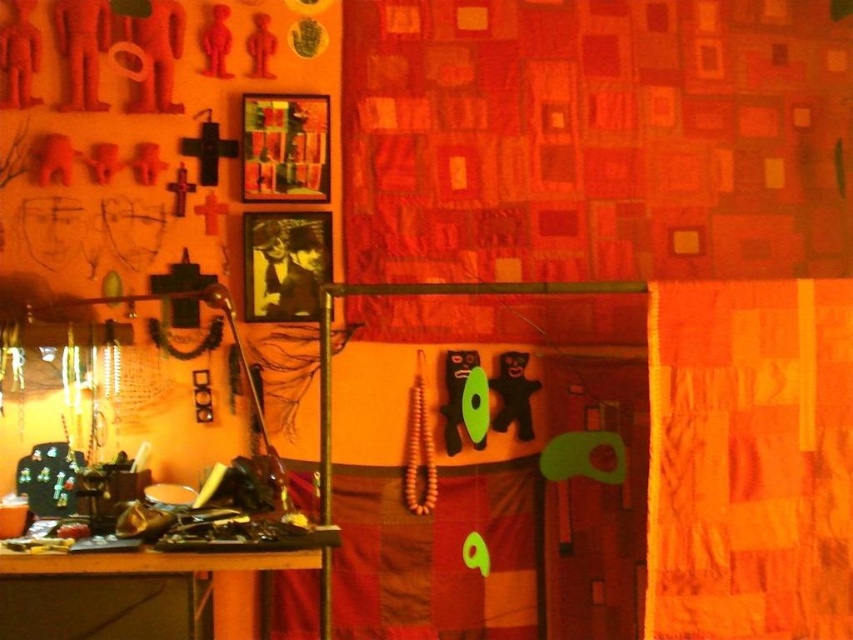
What do you see at coordinates (749, 460) in the screenshot? The height and width of the screenshot is (640, 853). I see `orange quilted curtain at upper right` at bounding box center [749, 460].

Does orange quilted curtain at upper right appear on the left side of wooden table at lower left?

In fact, orange quilted curtain at upper right is to the right of wooden table at lower left.

Locate an element on the screen. The width and height of the screenshot is (853, 640). orange quilted curtain at upper right is located at coordinates (749, 460).

At what (x,y) coordinates should I click in order to perform the action: click on orange quilted curtain at upper right. Please return your answer as a coordinate pair (x, y). This screenshot has height=640, width=853. Looking at the image, I should click on (749, 460).